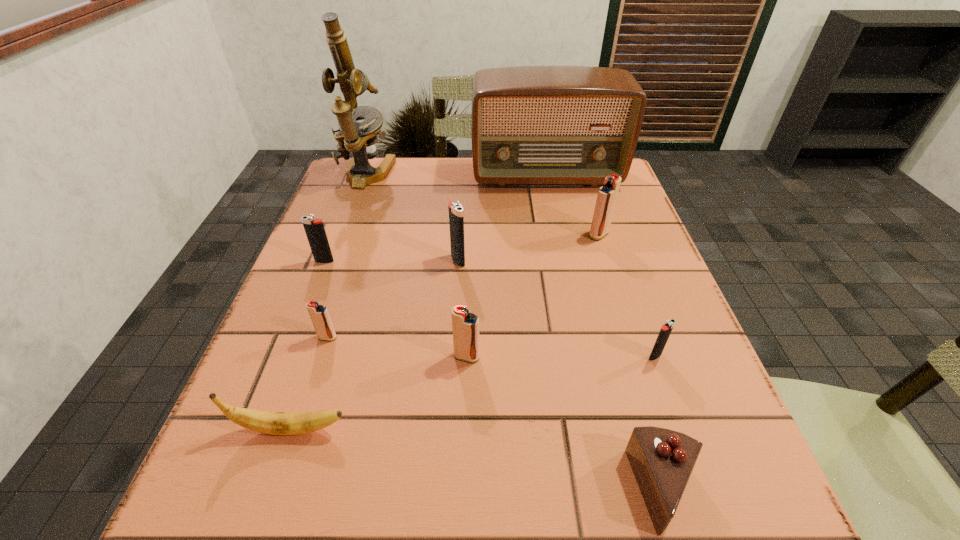
Locate an element on the screen. The height and width of the screenshot is (540, 960). banana situated at the left edge is located at coordinates (276, 423).

Find the location of a particular element. radio receiver that is at the right edge is located at coordinates (553, 124).

At what (x,y) coordinates should I click in order to perform the action: click on chocolate cake situated at the right edge. Please return your answer as a coordinate pair (x, y). Looking at the image, I should click on (662, 460).

You are a GUI agent. You are given a task and a screenshot of the screen. Output one action in this format:
    pyautogui.click(x=<x>, y=<y>)
    Task: Click on the object present at the far left corner
    
    Given the screenshot: What is the action you would take?
    pyautogui.click(x=359, y=138)

Where is `object positioned at the far right corner`? The width and height of the screenshot is (960, 540). object positioned at the far right corner is located at coordinates (553, 124).

Locate an element on the screen. object at the near right corner is located at coordinates (662, 460).

You are a GUI agent. You are given a task and a screenshot of the screen. Output one action in this format:
    pyautogui.click(x=<x>, y=<y>)
    Task: Click on the vacant space at the far edge of the desktop
    
    Given the screenshot: What is the action you would take?
    pyautogui.click(x=532, y=190)

At what (x,y) coordinates should I click in order to perform the action: click on vacant space at the near edge of the desktop. Please return your answer as a coordinate pair (x, y). Image resolution: width=960 pixels, height=540 pixels. Looking at the image, I should click on (508, 516).

You are a GUI agent. You are given a task and a screenshot of the screen. Output one action in this format:
    pyautogui.click(x=<x>, y=<y>)
    Task: Click on the vacant space at the left edge
    Image resolution: width=960 pixels, height=540 pixels.
    Given the screenshot: What is the action you would take?
    pyautogui.click(x=280, y=455)

Identify the location of vacant space at the right edge of the desktop. This screenshot has height=540, width=960. (626, 302).